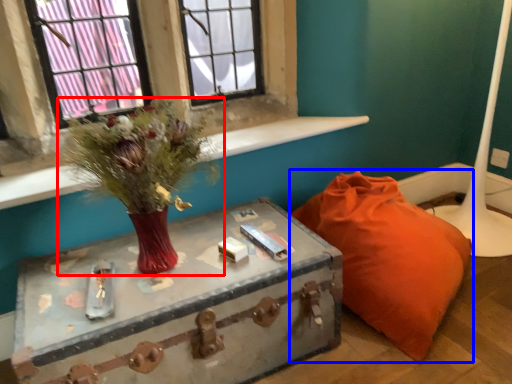
Question: Among these objects, which one is farthest to the camera, floral arrangement (highlighted by a red box) or furniture (highlighted by a blue box)?

Choices:
 (A) floral arrangement
 (B) furniture

Answer: (B)